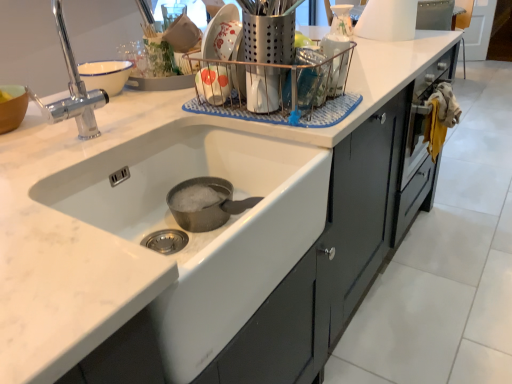
Where is `free space in front of clear plastic container at upper center, the third appliance in the back-to-front sequence`? free space in front of clear plastic container at upper center, the third appliance in the back-to-front sequence is located at coordinates (336, 100).